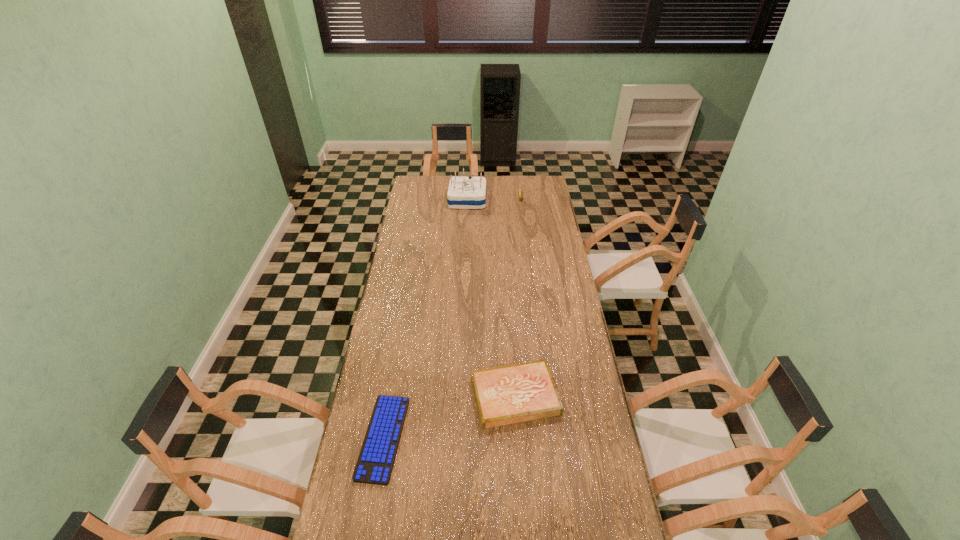
At what (x,y) coordinates should I click in order to perform the action: click on vacant space that is in between the shortest object and the second tallest object. Please return your answer as a coordinate pair (x, y). Looking at the image, I should click on (452, 317).

Locate an element on the screen. The width and height of the screenshot is (960, 540). free space between the third tallest object and the computer keyboard is located at coordinates (449, 417).

Find the location of a particular element. The width and height of the screenshot is (960, 540). free point between the hardback book and the second tallest object is located at coordinates (517, 296).

Where is `free spot between the shortest object and the banana`? The width and height of the screenshot is (960, 540). free spot between the shortest object and the banana is located at coordinates (452, 317).

Locate an element on the screen. The height and width of the screenshot is (540, 960). free area in between the shortest object and the banana is located at coordinates (452, 317).

Find the location of a particular element. Image resolution: width=960 pixels, height=540 pixels. free space between the hardback book and the computer keyboard is located at coordinates (449, 417).

The height and width of the screenshot is (540, 960). I want to click on the closest object relative to the second tallest object, so click(x=463, y=192).

Locate an element on the screen. The image size is (960, 540). object that is the third closest to the hardback book is located at coordinates (520, 191).

Find the location of a particular element. blank space that satisfies the following two spatial constraints: 1. on the back side of the shortest object; 2. on the right side of the birthday cake is located at coordinates pyautogui.click(x=424, y=200).

Locate an element on the screen. The width and height of the screenshot is (960, 540). vacant area that satisfies the following two spatial constraints: 1. on the back side of the hardback book; 2. on the right side of the shortest object is located at coordinates (391, 396).